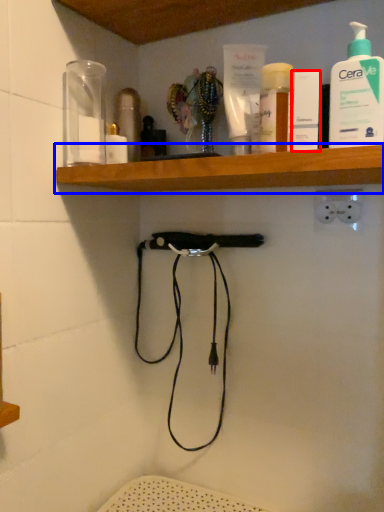
Question: Which of the following is the closest to the observer, toiletry (highlighted by a red box) or shelf (highlighted by a blue box)?

Choices:
 (A) toiletry
 (B) shelf

Answer: (B)